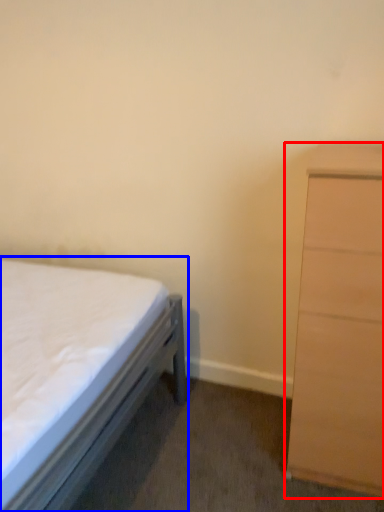
Question: Among these objects, which one is nearest to the camera, chest of drawers (highlighted by a red box) or bed (highlighted by a blue box)?

Choices:
 (A) chest of drawers
 (B) bed

Answer: (B)